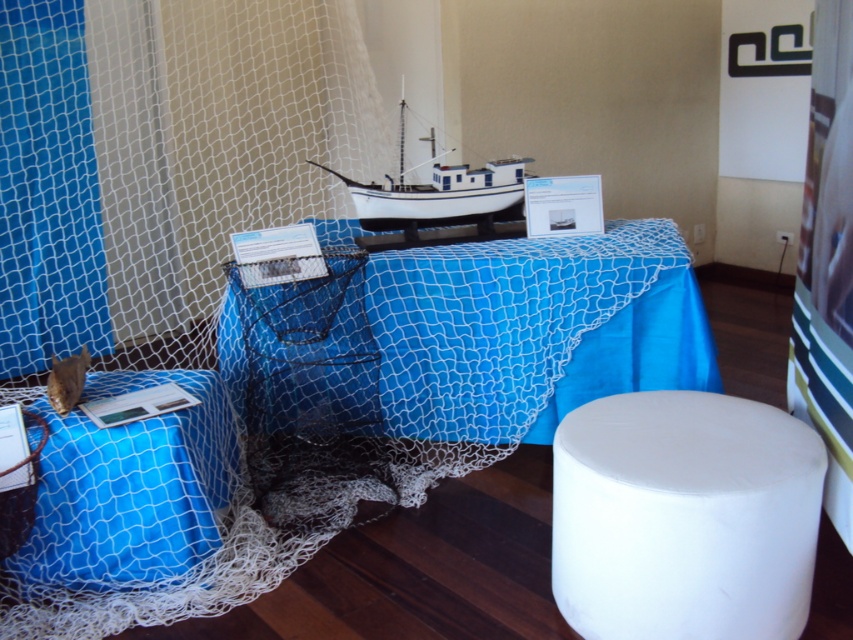
You are a museum curator who needs to place a new decorative item on the table. The item requires a space of 24 inches. Can the space between the blue netting tablecloth at center and the white matte boat at center accommodate this item?

The distance between the blue netting tablecloth at center and the white matte boat at center is 23.94 inches, which is slightly less than the required 24 inches. Therefore, the space is insufficient to accommodate the item.

You are a visitor at the exhibition and want to take a photo of the blue netting tablecloth at center. If your camera has a minimum focus distance of 2 meters, will you need to step back to take the photo?

The blue netting tablecloth at center is 1.99 meters away from the viewer, which is less than the camera minimum focus distance of 2 meters. Therefore, you need to step back to take the photo.

You are standing in front of the indoor display setup and want to determine which of the two points, point (596, 259) or point (91, 440), is closer to you. Based on the coordinates provided, which point is nearer?

Point (596, 259) is further to the viewer than point (91, 440), so the point closer to you is point (91, 440).